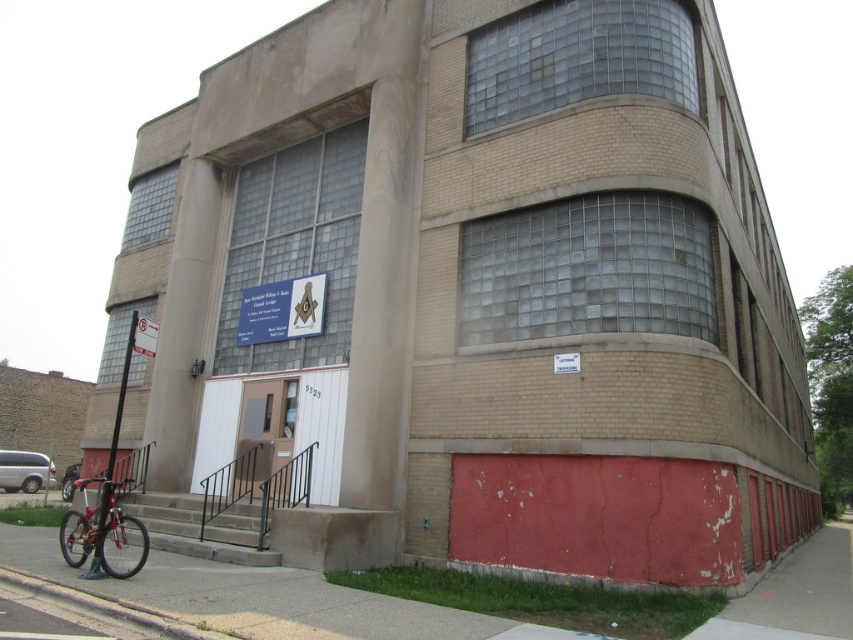
Question: Can you confirm if smooth concrete column at center is thinner than white matte sign at center?

Choices:
 (A) no
 (B) yes

Answer: (B)

Question: From the image, what is the correct spatial relationship of beige concrete pillar at left in relation to white paper sign at upper left?

Choices:
 (A) right
 (B) left

Answer: (A)

Question: Which of the following is the farthest from the observer?

Choices:
 (A) smooth concrete column at center
 (B) white paper sign at upper left
 (C) beige concrete pillar at left
 (D) red matte bicycle at lower left

Answer: (C)

Question: Which is nearer to the smooth concrete column at center?

Choices:
 (A) white matte sign at center
 (B) white paper sign at upper left
 (C) red matte bicycle at lower left

Answer: (A)

Question: Is smooth concrete column at center smaller than white matte sign at center?

Choices:
 (A) no
 (B) yes

Answer: (B)

Question: Based on their relative distances, which object is farther from the beige concrete pillar at left?

Choices:
 (A) red matte bicycle at lower left
 (B) smooth concrete column at center
 (C) white matte sign at center
 (D) white paper sign at upper left

Answer: (B)